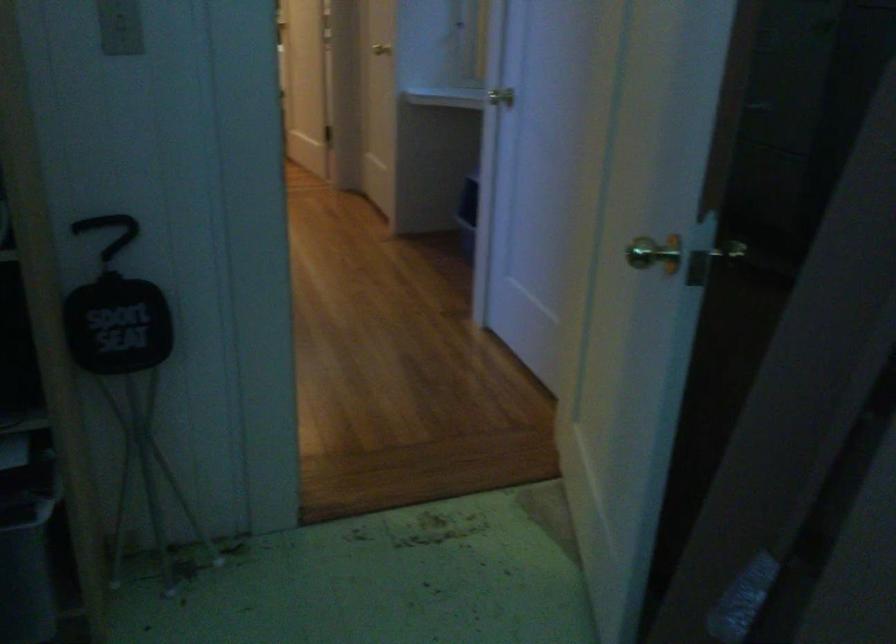
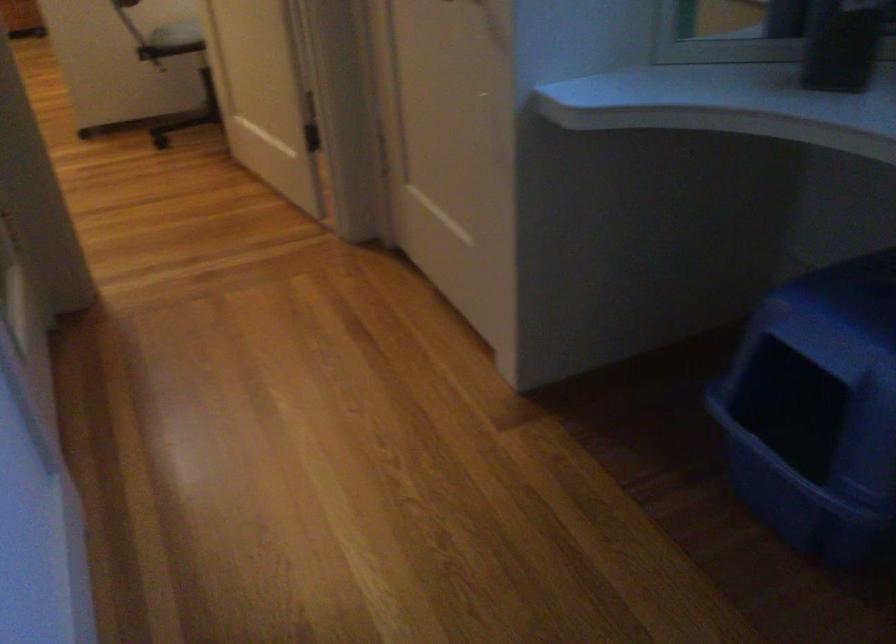
Question: Which direction would the cameraman need to move to produce the second image? Reply with the corresponding letter.

Choices:
 (A) Left
 (B) Right
 (C) Forward
 (D) Backward

Answer: (C)